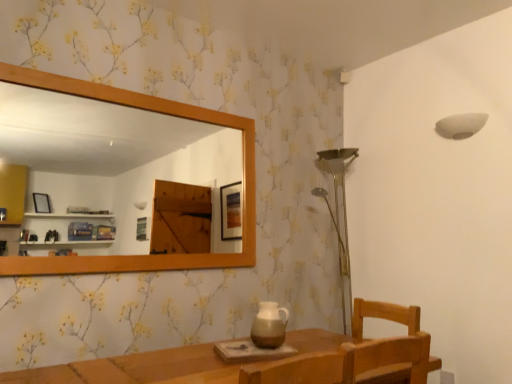
The height and width of the screenshot is (384, 512). I want to click on vacant space that is to the left of brown ceramic pitcher at center, so click(x=236, y=344).